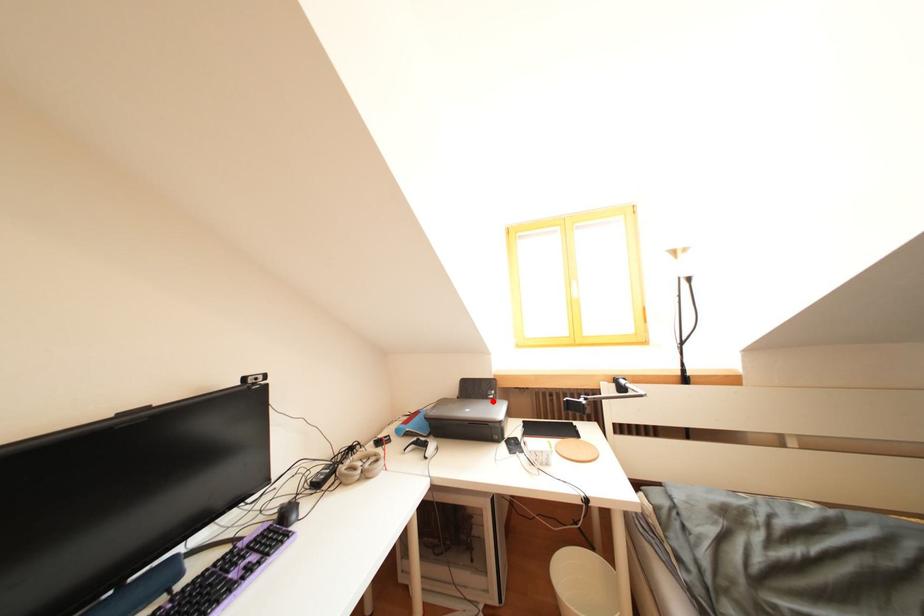
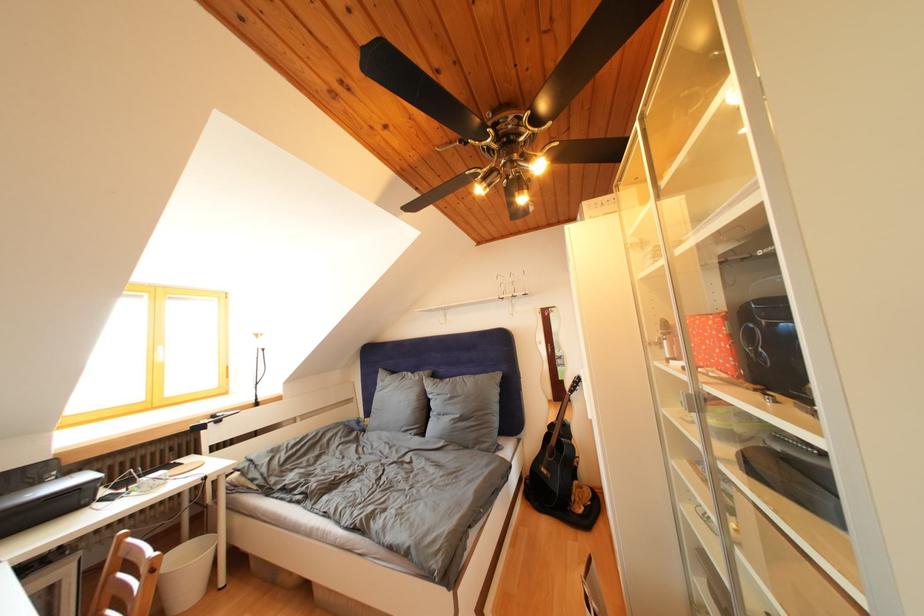
Question: I am providing you with two images of the same scene from different viewpoints. A red point is shown in image1. For the corresponding object point in image2, is it positioned nearer or farther from the camera?

Choices:
 (A) Nearer
 (B) Farther

Answer: (A)